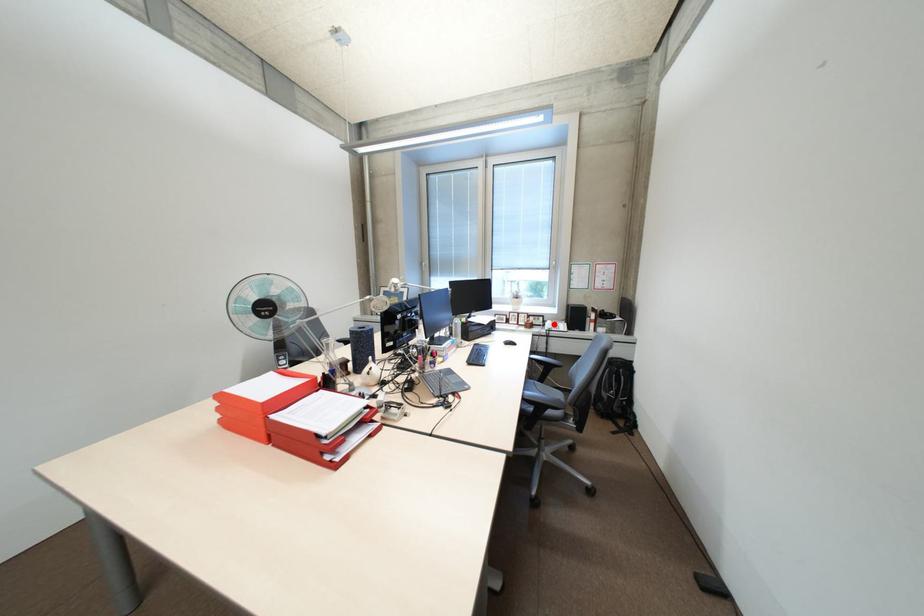
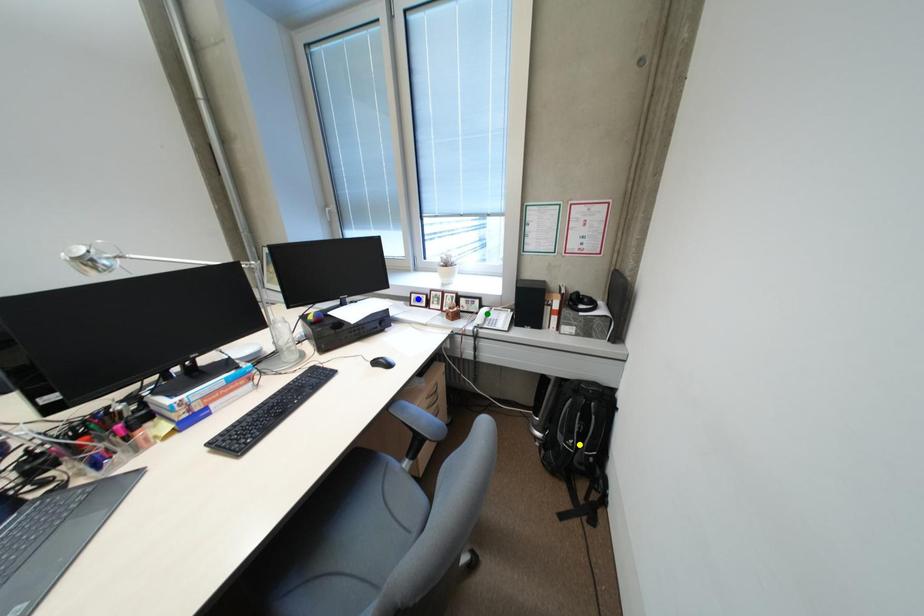
Question: I am providing you with two images of the same scene from different viewpoints. A red point is marked on the first image. You are given multiple points on the second image. Which spot in image 2 lines up with the point in image 1?

Choices:
 (A) blue point
 (B) green point
 (C) yellow point

Answer: (B)